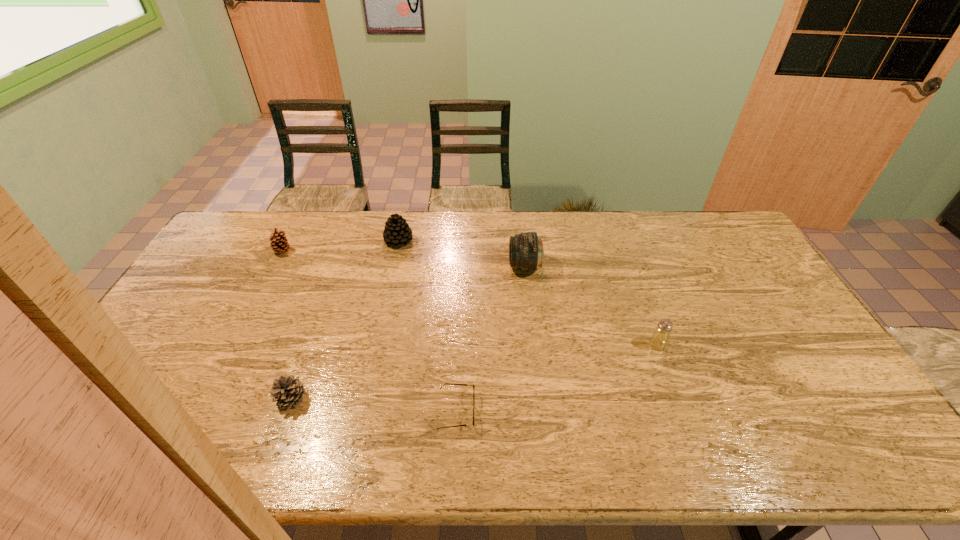
Identify the location of free space between the shortest object and the telephoto lens. (491, 339).

Locate an element on the screen. This screenshot has height=540, width=960. vacant space that is in between the second object from left to right and the rightmost object is located at coordinates point(474,372).

At what (x,y) coordinates should I click in order to perform the action: click on vacant area that lies between the saltshaker and the fourth object from right to left. Please return your answer as a coordinate pair (x, y). Looking at the image, I should click on 528,293.

At what (x,y) coordinates should I click in order to perform the action: click on empty location between the fifth object from right to left and the fourth farthest object. Please return your answer as a coordinate pair (x, y). Looking at the image, I should click on (474, 372).

Where is `object that is the closest to the shortest pinecone`? object that is the closest to the shortest pinecone is located at coordinates (444, 384).

Select which object appears as the fifth closest to the leftmost object. Please provide its 2D coordinates. Your answer should be formatted as a tuple, i.e. [(x, y)], where the tuple contains the x and y coordinates of a point satisfying the conditions above.

[(659, 339)]

Find the location of a particular element. The height and width of the screenshot is (540, 960). the second closest pinecone to the nearest pinecone is located at coordinates (397, 232).

Identify the location of pinecone that is the closest to the leftmost object. (397, 232).

You are a GUI agent. You are given a task and a screenshot of the screen. Output one action in this format:
    pyautogui.click(x=<x>, y=<y>)
    Task: Click on the free space in the image that satisfies the following two spatial constraints: 1. at the narrow end of the rightmost pinecone; 2. on the front side of the leftmost pinecone
    This screenshot has width=960, height=540.
    Given the screenshot: What is the action you would take?
    pyautogui.click(x=396, y=252)

Locate an element on the screen. Image resolution: width=960 pixels, height=540 pixels. free space that satisfies the following two spatial constraints: 1. at the front element of the second object from right to left; 2. on the left side of the third nearest object is located at coordinates (533, 345).